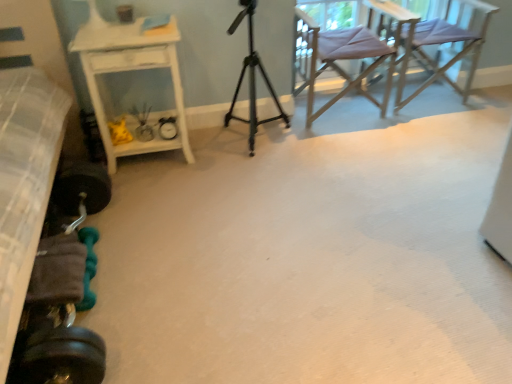
Question: Is light purple fabric chair at upper right, marked as the second chair in a left-to-right arrangement, surrounding white glossy side table at left?

Choices:
 (A) no
 (B) yes

Answer: (A)

Question: Is light purple fabric chair at upper right, marked as the second chair in a left-to-right arrangement, looking in the opposite direction of white glossy side table at left?

Choices:
 (A) no
 (B) yes

Answer: (A)

Question: Considering the relative positions of light purple fabric chair at upper right, the 1th chair when ordered from right to left, and white glossy side table at left in the image provided, is light purple fabric chair at upper right, the 1th chair when ordered from right to left, in front of white glossy side table at left?

Choices:
 (A) no
 (B) yes

Answer: (A)

Question: Is light purple fabric chair at upper right, the 1th chair when ordered from right to left, smaller than white glossy side table at left?

Choices:
 (A) no
 (B) yes

Answer: (A)

Question: Is light purple fabric chair at upper right, marked as the second chair in a left-to-right arrangement, to the left of white glossy side table at left from the viewer's perspective?

Choices:
 (A) no
 (B) yes

Answer: (A)

Question: Would you say light purple fabric chair at upper right, the 1th chair when ordered from right to left, is inside or outside metallic tripod at center?

Choices:
 (A) outside
 (B) inside

Answer: (A)

Question: From their relative heights in the image, would you say light purple fabric chair at upper right, the 1th chair when ordered from right to left, is taller or shorter than metallic tripod at center?

Choices:
 (A) short
 (B) tall

Answer: (A)

Question: From the image's perspective, is light purple fabric chair at upper right, marked as the second chair in a left-to-right arrangement, located above or below metallic tripod at center?

Choices:
 (A) below
 (B) above

Answer: (B)

Question: Looking at their shapes, would you say light purple fabric chair at upper right, the 1th chair when ordered from right to left, is wider or thinner than metallic tripod at center?

Choices:
 (A) thin
 (B) wide

Answer: (B)

Question: Is metallic tripod at center in front of or behind light purple fabric chair at upper right, the 1th chair when ordered from right to left, in the image?

Choices:
 (A) behind
 (B) front

Answer: (B)

Question: Considering the positions of point (250, 129) and point (441, 21), is point (250, 129) closer or farther from the camera than point (441, 21)?

Choices:
 (A) closer
 (B) farther

Answer: (A)

Question: From a real-world perspective, is metallic tripod at center positioned above or below light purple fabric chair at upper right, the 1th chair when ordered from right to left?

Choices:
 (A) below
 (B) above

Answer: (B)

Question: In terms of size, does metallic tripod at center appear bigger or smaller than light purple fabric chair at upper right, marked as the second chair in a left-to-right arrangement?

Choices:
 (A) big
 (B) small

Answer: (B)

Question: From a real-world perspective, is white glossy side table at left above or below textured gray bed at left?

Choices:
 (A) below
 (B) above

Answer: (A)

Question: Which is correct: white glossy side table at left is inside textured gray bed at left, or outside of it?

Choices:
 (A) outside
 (B) inside

Answer: (A)